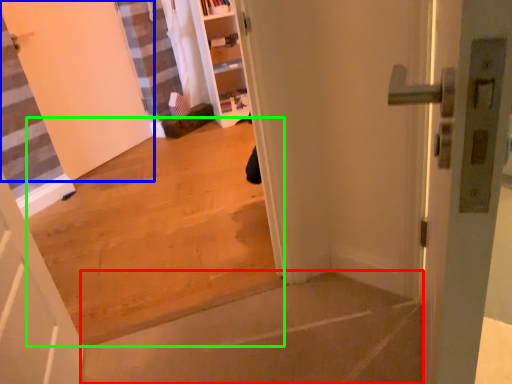
Question: Which is nearer to the concrete (highlighted by a red box)? door (highlighted by a blue box) or concrete (highlighted by a green box).

Choices:
 (A) door
 (B) concrete

Answer: (B)